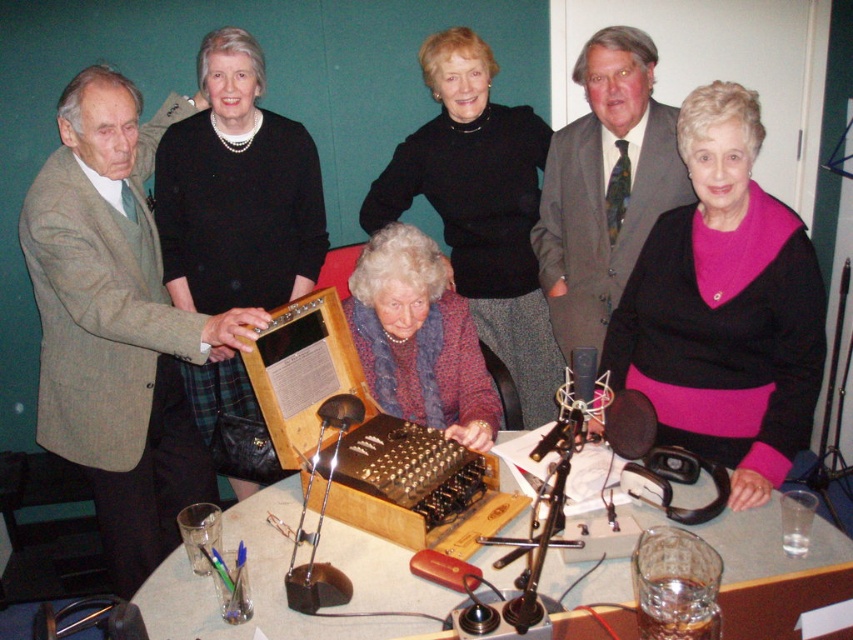
Question: Which point is farther to the camera?

Choices:
 (A) (276, 614)
 (B) (527, 300)
 (C) (111, 392)

Answer: (B)

Question: Can you confirm if gray suit at center is positioned below floral sweater at center?

Choices:
 (A) no
 (B) yes

Answer: (A)

Question: Can you confirm if wooden table at center is positioned to the left of gray suit at center?

Choices:
 (A) no
 (B) yes

Answer: (B)

Question: Does black wool sweater at upper center have a larger size compared to gray suit at center?

Choices:
 (A) no
 (B) yes

Answer: (B)

Question: Which of these objects is positioned closest to the black matte jacket at upper left?

Choices:
 (A) gray suit at center
 (B) black wool sweater at upper center

Answer: (B)

Question: Which of the following is the closest to the observer?

Choices:
 (A) (x=471, y=420)
 (B) (x=70, y=321)
 (C) (x=805, y=234)
 (D) (x=264, y=163)

Answer: (C)